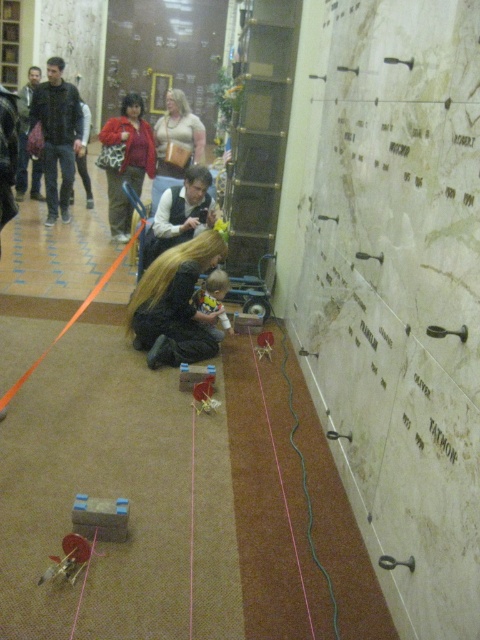
Between black matte dress at center and matte black hair at center, which one appears on the right side from the viewer's perspective?

black matte dress at center is more to the right.

Is point (186, 276) farther from viewer compared to point (210, 211)?

No, it is in front of (210, 211).

Does point (195, 317) lie in front of point (170, 230)?

Yes.

Where is `black matte dress at center`? black matte dress at center is located at coordinates (175, 305).

Looking at this image, who is taller, dark blue jeans at left or matte black hair at center?

dark blue jeans at left is taller.

Is point (57, 134) positioned in front of point (191, 195)?

No, (57, 134) is further to viewer.

Where is `dark blue jeans at left`? The height and width of the screenshot is (640, 480). dark blue jeans at left is located at coordinates (58, 134).

Does black matte dress at center appear over dark blue jeans at left?

Actually, black matte dress at center is below dark blue jeans at left.

Describe the element at coordinates (175, 305) in the screenshot. This screenshot has height=640, width=480. I see `black matte dress at center` at that location.

Locate an element on the screen. This screenshot has height=640, width=480. black matte dress at center is located at coordinates (175, 305).